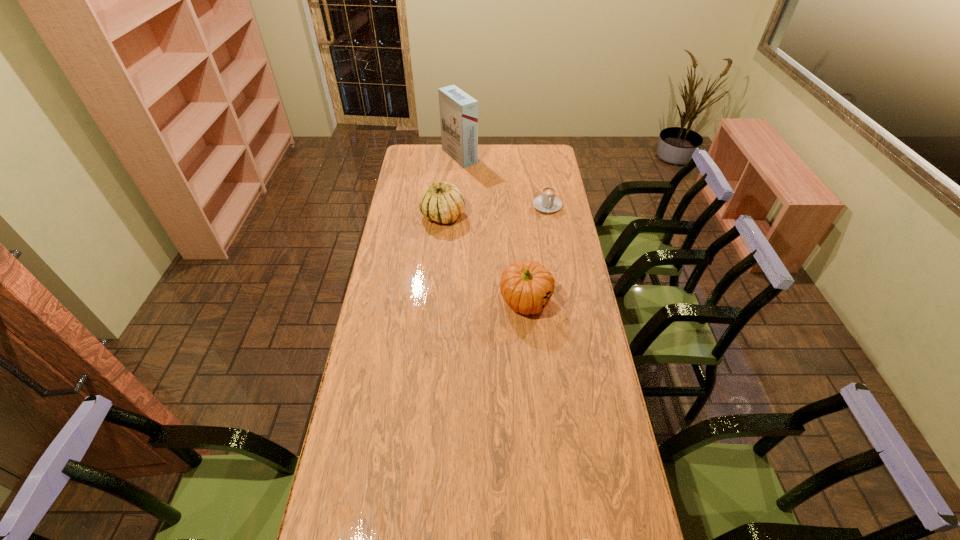
Find the location of a particular element. The height and width of the screenshot is (540, 960). blank region between the gourd and the fourth farthest object is located at coordinates (484, 259).

The height and width of the screenshot is (540, 960). I want to click on empty space that is in between the second shortest object and the pumpkin, so click(537, 254).

What are the coordinates of `object that stands as the second closest to the farthest object` in the screenshot? It's located at (547, 202).

Identify which object is the third closest to the gourd. Please provide its 2D coordinates. Your answer should be formatted as a tuple, i.e. [(x, y)], where the tuple contains the x and y coordinates of a point satisfying the conditions above.

[(526, 286)]